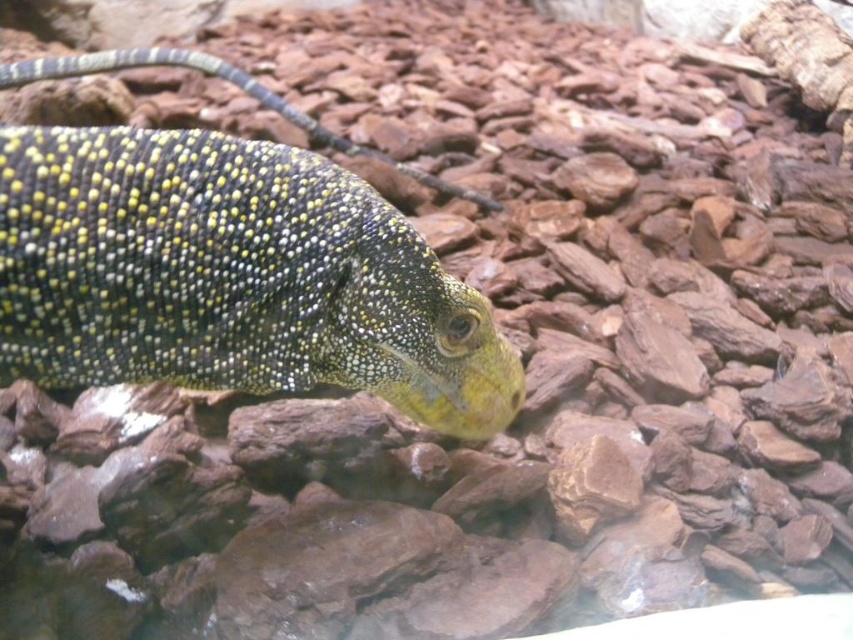
Question: Does shiny green scales at center appear under shiny yellow scales at center?

Choices:
 (A) no
 (B) yes

Answer: (B)

Question: Among these objects, which one is nearest to the camera?

Choices:
 (A) shiny green scales at center
 (B) shiny yellow scales at center

Answer: (A)

Question: Which point is farther to the camera?

Choices:
 (A) (373, 154)
 (B) (247, 289)

Answer: (A)

Question: Is shiny green scales at center in front of shiny yellow scales at center?

Choices:
 (A) yes
 (B) no

Answer: (A)

Question: Does shiny green scales at center have a larger size compared to shiny yellow scales at center?

Choices:
 (A) no
 (B) yes

Answer: (A)